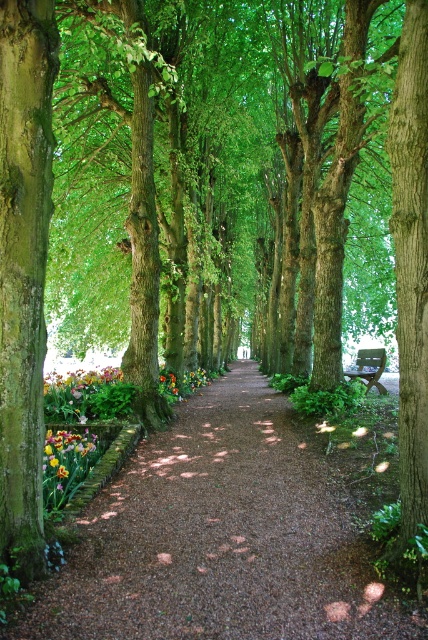
You are a gardener who wants to place a new flower pot between the bright yellow tulip at lower left and the wooden bench at center. Based on their positions, where should the flower pot be placed?

The bright yellow tulip at lower left is located below the wooden bench at center, so the flower pot should be placed between them along the vertical axis.

You are a gardener standing at the edge of the pathway. You need to place a new decorative statue between the vibrant multicolored petals at center and the multicolored fabric flowers at center. Can you fit the statue if it requires 2 meters of space between them?

The distance between the vibrant multicolored petals at center and the multicolored fabric flowers at center is 2.22 meters. Since the statue needs 2 meters of space, there is enough room to place it between them.

You are a gardener who wants to plant a new flower bed. You have a bright yellow tulip at lower left and a brown gravel path at center. Which object takes up more space in the image?

The brown gravel path at center takes up more space in the image than the bright yellow tulip at lower left because it is bigger.